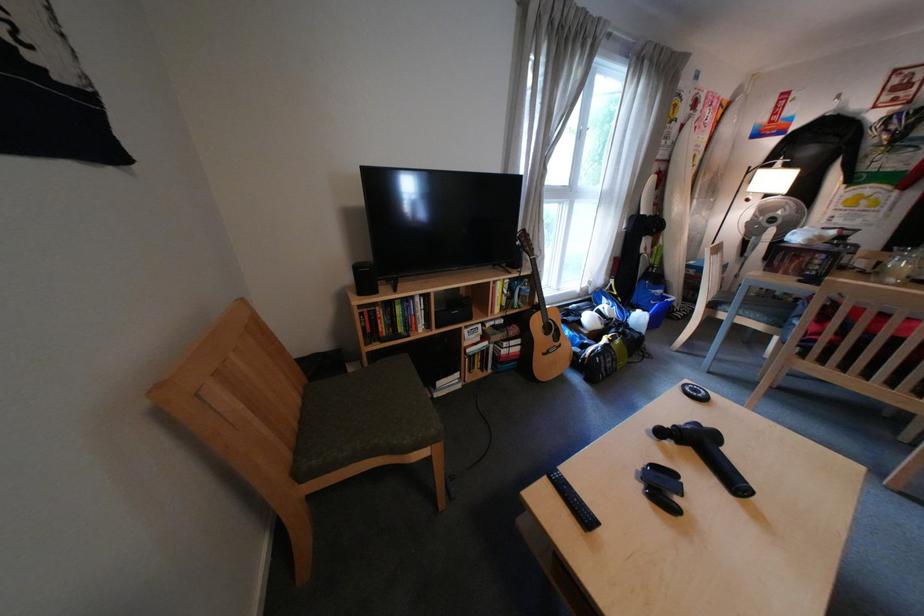
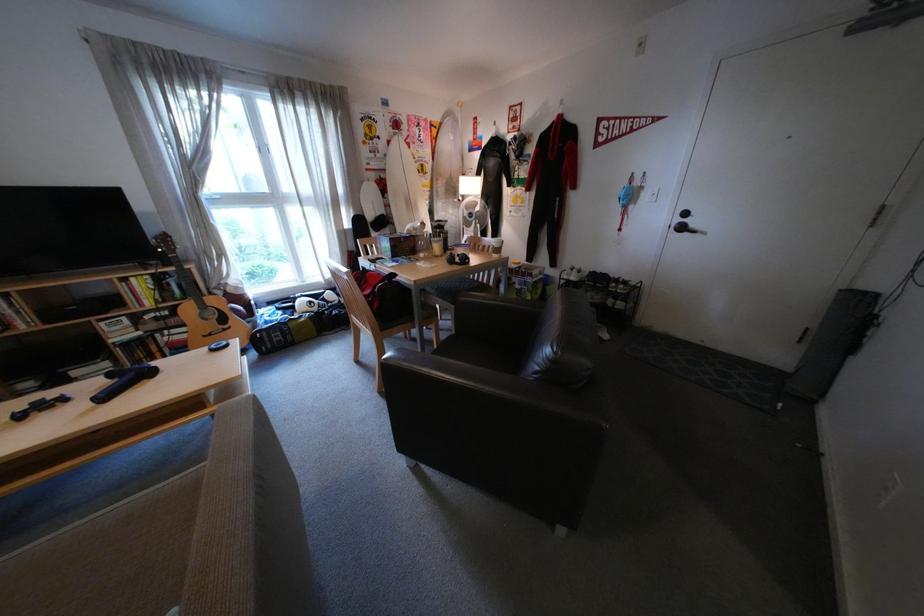
Question: Which direction would the cameraman need to move to produce the second image? Reply with the corresponding letter.

Choices:
 (A) Left
 (B) Right
 (C) Forward
 (D) Backward

Answer: (B)